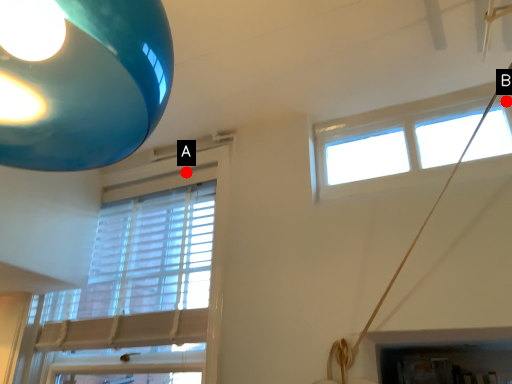
Question: Two points are circled on the image, labeled by A and B beside each circle. Which of the following is the farthest from the observer?

Choices:
 (A) A is further
 (B) B is further

Answer: (A)